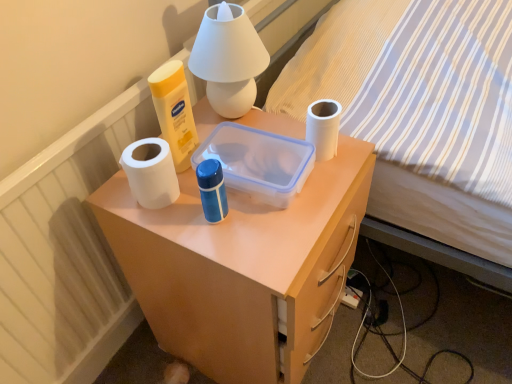
The image size is (512, 384). I want to click on empty space that is ontop of white matte desk at center (from a real-world perspective), so click(x=249, y=170).